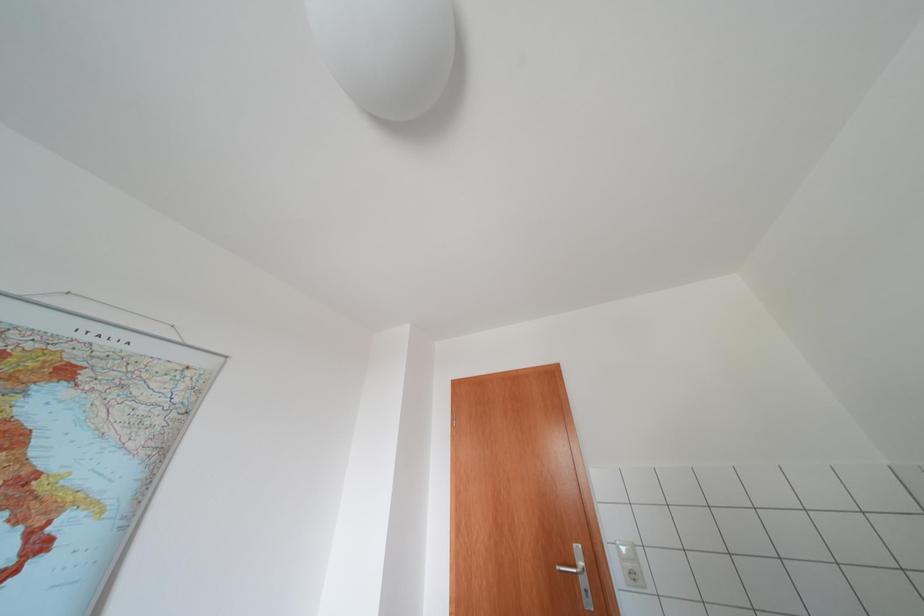
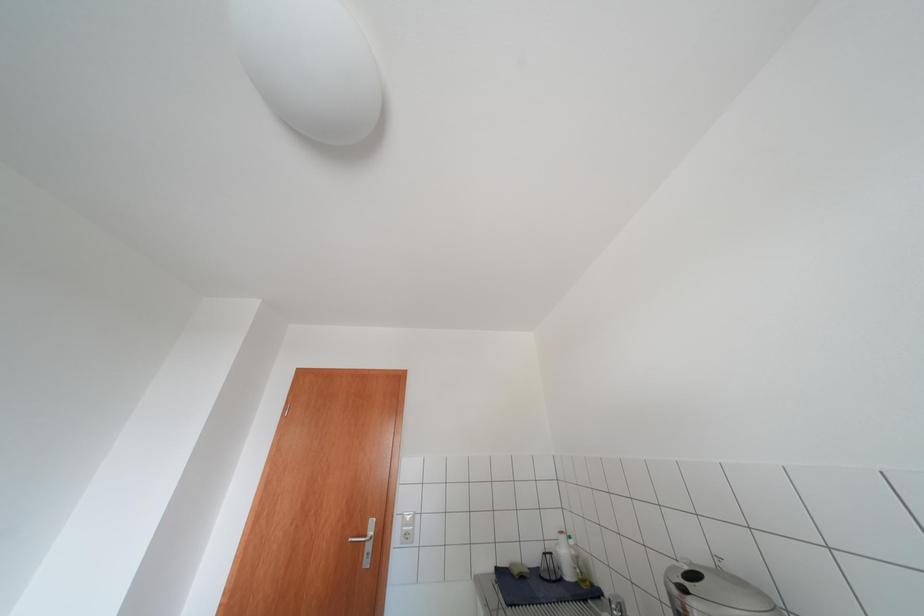
Question: The camera is either moving clockwise (left) or counter-clockwise (right) around the object. The first image is from the beginning of the video and the second image is from the end. Is the camera moving left or right when shooting the video?

Choices:
 (A) Left
 (B) Right

Answer: (A)